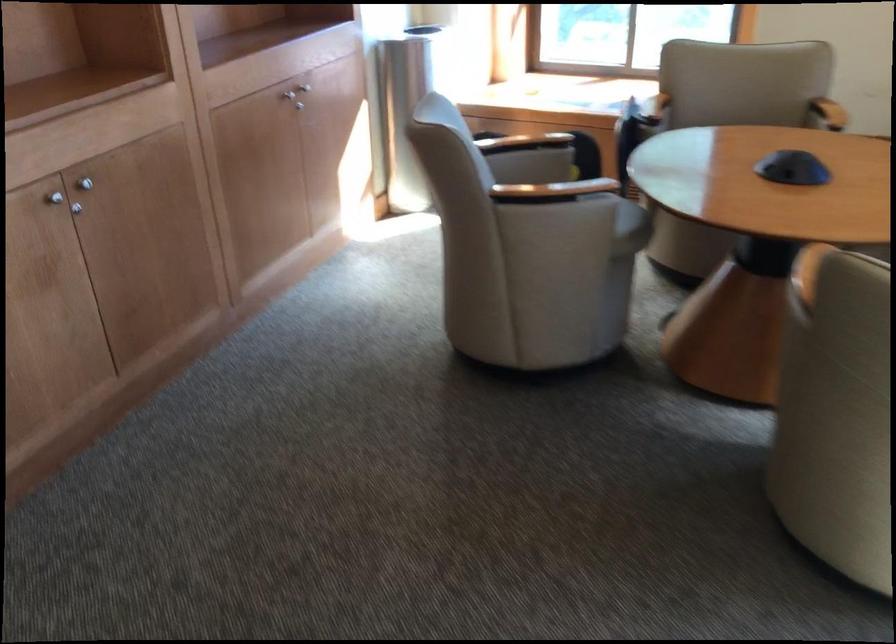
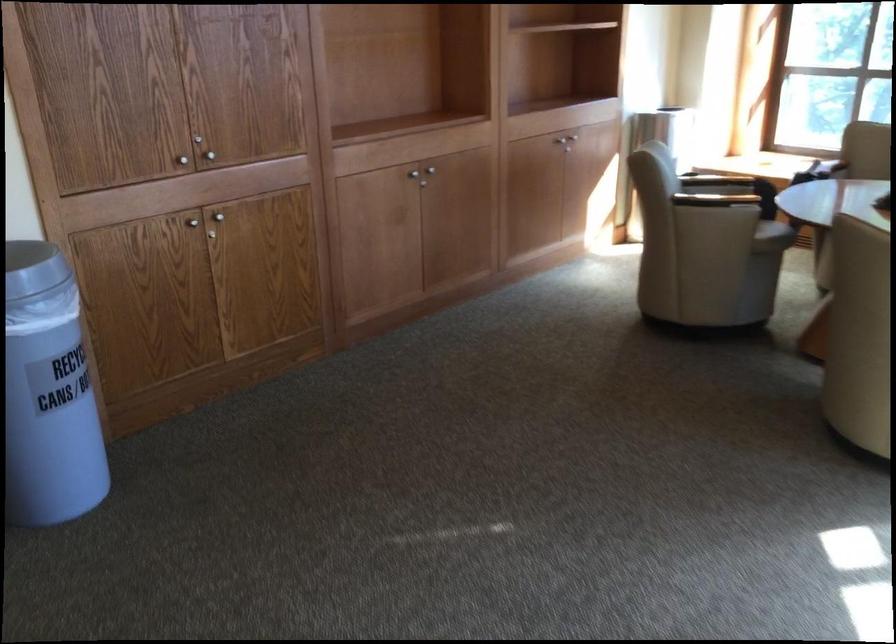
In the second image, find the point that corresponds to point 584,232 in the first image.

(739, 225)